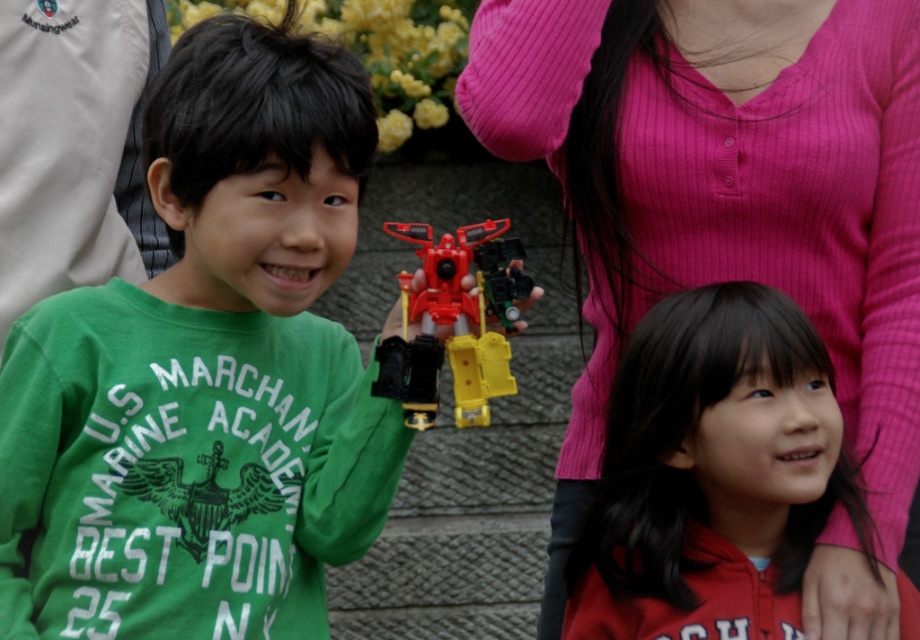
Question: Which object is positioned closest to the pink ribbed sweater at upper center?

Choices:
 (A) green matte shirt at left
 (B) matte red hoodie at center
 (C) matte plastic robot at center

Answer: (B)

Question: Among these objects, which one is farthest from the camera?

Choices:
 (A) pink ribbed sweater at upper center
 (B) green matte shirt at left

Answer: (A)

Question: Which object is the closest to the matte red hoodie at center?

Choices:
 (A) green matte shirt at left
 (B) matte plastic robot at center
 (C) pink ribbed sweater at upper center

Answer: (C)

Question: Can you confirm if pink ribbed sweater at upper center is bigger than matte red hoodie at center?

Choices:
 (A) no
 (B) yes

Answer: (B)

Question: Does matte red hoodie at center appear on the right side of matte plastic robot at center?

Choices:
 (A) no
 (B) yes

Answer: (B)

Question: Does matte red hoodie at center have a lesser width compared to matte plastic robot at center?

Choices:
 (A) no
 (B) yes

Answer: (A)